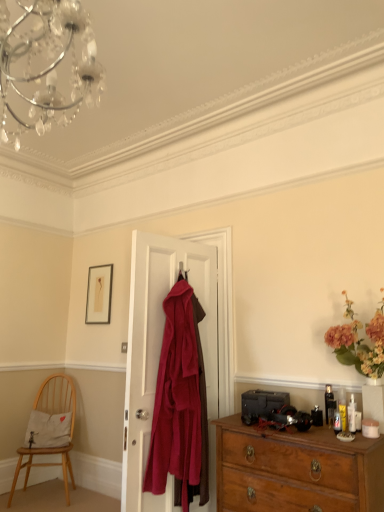
Question: In terms of size, does light wood chair at lower left appear bigger or smaller than wooden chest of drawers at lower right?

Choices:
 (A) small
 (B) big

Answer: (B)

Question: Considering the positions of point (57, 449) and point (276, 494), is point (57, 449) closer or farther from the camera than point (276, 494)?

Choices:
 (A) closer
 (B) farther

Answer: (B)

Question: Which object is positioned farthest from the light wood chair at lower left?

Choices:
 (A) velvet burgundy coat at center
 (B) wooden chest of drawers at lower right
 (C) matte gold picture frame at upper left

Answer: (B)

Question: Which object is positioned farthest from the velvet burgundy coat at center?

Choices:
 (A) light wood chair at lower left
 (B) matte gold picture frame at upper left
 (C) wooden chest of drawers at lower right

Answer: (A)